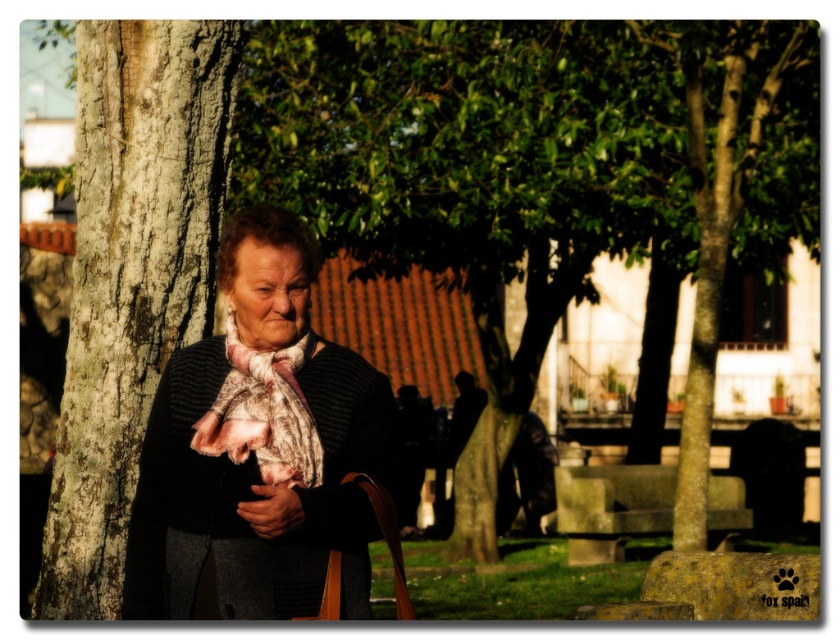
Question: Which object is closer to the camera taking this photo?

Choices:
 (A) dark blue jeans at lower right
 (B) dark gray fabric jacket at center

Answer: (B)

Question: Which point appears farthest from the camera in this image?

Choices:
 (A) (113, 160)
 (B) (269, 504)
 (C) (197, 406)

Answer: (A)

Question: Can you confirm if smooth bark tree trunk at left is positioned below smooth brown leather handbag at lower center?

Choices:
 (A) yes
 (B) no

Answer: (B)

Question: Which point is farther to the camera?

Choices:
 (A) dark blue jeans at lower right
 (B) dark gray fabric jacket at center
 (C) smooth brown leather handbag at lower center

Answer: (A)

Question: Is printed silk scarf at center below smooth brown leather handbag at lower center?

Choices:
 (A) yes
 (B) no

Answer: (B)

Question: Is matte black sweater at center behind dark blue jeans at lower right?

Choices:
 (A) no
 (B) yes

Answer: (A)